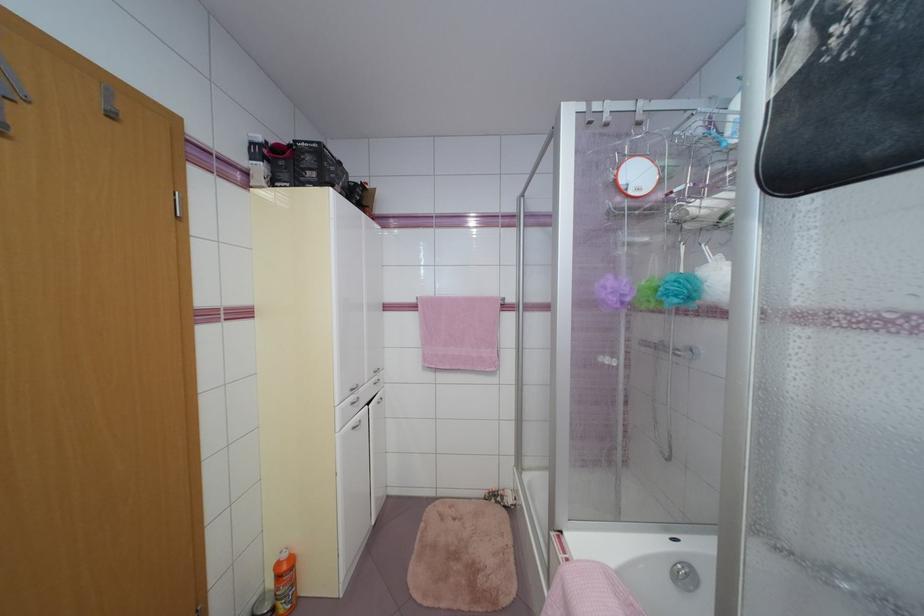
Find where to lift the black product box. Please return your answer as a coordinate pair (x, y).

(302, 164)